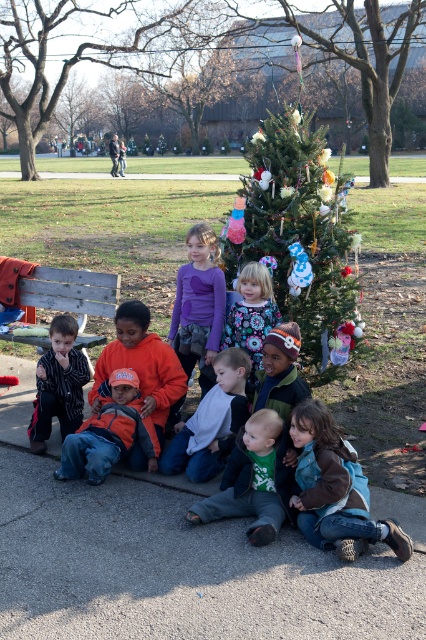
Question: Among these objects, which one is nearest to the camera?

Choices:
 (A) green textured christmas tree at center
 (B) white cotton shirt at center
 (C) brown fuzzy jacket at lower right
 (D) orange fleece jacket at lower left

Answer: (C)

Question: Based on their relative distances, which object is farther from the orange fleece jacket at center?

Choices:
 (A) green matte christmas tree at center
 (B) brown fuzzy jacket at lower right
 (C) white cotton shirt at center

Answer: (B)

Question: Is green textured christmas tree at center positioned behind striped cotton shirt at left?

Choices:
 (A) no
 (B) yes

Answer: (B)

Question: Which of the following is the closest to the observer?

Choices:
 (A) brown fuzzy jacket at lower right
 (B) green matte shirt at center
 (C) white cotton shirt at center
 (D) wooden bench at left

Answer: (A)

Question: Can you confirm if green matte christmas tree at center is bigger than wooden bench at left?

Choices:
 (A) no
 (B) yes

Answer: (B)

Question: Is green matte shirt at center bigger than striped cotton shirt at left?

Choices:
 (A) yes
 (B) no

Answer: (A)